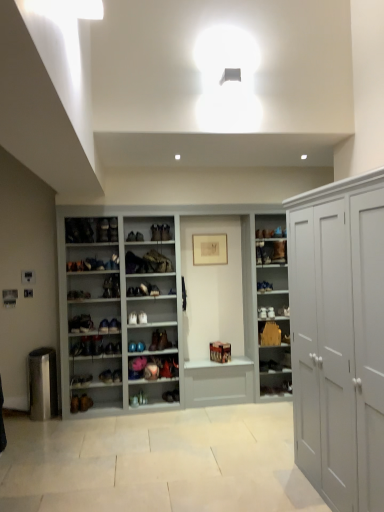
Question: Does matte brown boot at center, arranged as the eighth shoe when ordered from the bottom, come behind brown leather shoe at center, which appears as the 2th footwear when viewed from the right?

Choices:
 (A) no
 (B) yes

Answer: (A)

Question: Is matte brown boot at center, arranged as the eighth shoe when ordered from the bottom, bigger than brown leather shoe at center, which ranks as the first footwear in top-to-bottom order?

Choices:
 (A) no
 (B) yes

Answer: (A)

Question: Is matte brown boot at center, arranged as the eighth shoe when ordered from the bottom, next to brown leather shoe at center, which is counted as the 2th footwear, starting from the left, and touching it?

Choices:
 (A) no
 (B) yes

Answer: (A)

Question: Is matte brown boot at center, arranged as the eighth shoe when ordered from the bottom, at the right side of brown leather shoe at center, which appears as the third footwear when ordered from the bottom?

Choices:
 (A) yes
 (B) no

Answer: (B)

Question: From the image's perspective, is matte brown boot at center, arranged as the eighth shoe when ordered from the bottom, located above brown leather shoe at center, which appears as the 2th footwear when viewed from the right?

Choices:
 (A) yes
 (B) no

Answer: (B)

Question: Does matte brown boot at center, arranged as the eighth shoe when ordered from the bottom, have a lesser height compared to brown leather shoe at center, which appears as the 2th footwear when viewed from the right?

Choices:
 (A) yes
 (B) no

Answer: (A)

Question: Can you confirm if leather boot at center, which is the third footwear from right to left, is positioned to the left of shiny brown leather shoe at center, placed as the 4th shoe when sorted from top to bottom?

Choices:
 (A) yes
 (B) no

Answer: (B)

Question: Are leather boot at center, acting as the 2th footwear starting from the top, and shiny brown leather shoe at center, arranged as the seventh shoe when ordered from the bottom, located far from each other?

Choices:
 (A) yes
 (B) no

Answer: (B)

Question: Considering the relative sizes of leather boot at center, placed as the second footwear when sorted from bottom to top, and shiny brown leather shoe at center, arranged as the seventh shoe when ordered from the bottom, in the image provided, is leather boot at center, placed as the second footwear when sorted from bottom to top, smaller than shiny brown leather shoe at center, arranged as the seventh shoe when ordered from the bottom,?

Choices:
 (A) yes
 (B) no

Answer: (B)

Question: From a real-world perspective, is leather boot at center, placed as the second footwear when sorted from bottom to top, located beneath shiny brown leather shoe at center, placed as the 4th shoe when sorted from top to bottom?

Choices:
 (A) yes
 (B) no

Answer: (B)

Question: Does leather boot at center, placed as the second footwear when sorted from bottom to top, have a lesser width compared to shiny brown leather shoe at center, placed as the 4th shoe when sorted from top to bottom?

Choices:
 (A) no
 (B) yes

Answer: (A)

Question: Is shiny brown leather shoe at center, placed as the 4th shoe when sorted from top to bottom, at the back of leather boot at center, placed as the 1th footwear when sorted from left to right?

Choices:
 (A) yes
 (B) no

Answer: (B)

Question: Can you confirm if matte white shoe at center, which appears as the fifth shoe when viewed from the top, is smaller than matte brown boot at center, arranged as the first footwear when viewed from the right?

Choices:
 (A) yes
 (B) no

Answer: (B)